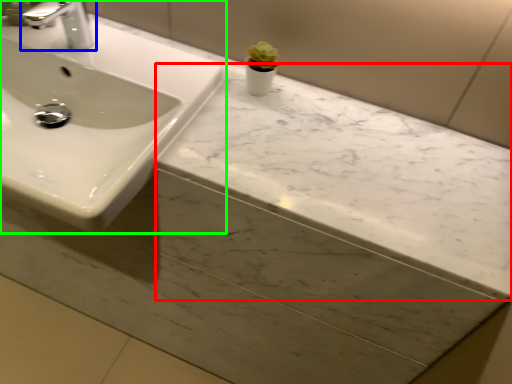
Question: Which is farther away from counter top (highlighted by a red box)? tap (highlighted by a blue box) or sink (highlighted by a green box)?

Choices:
 (A) tap
 (B) sink

Answer: (A)